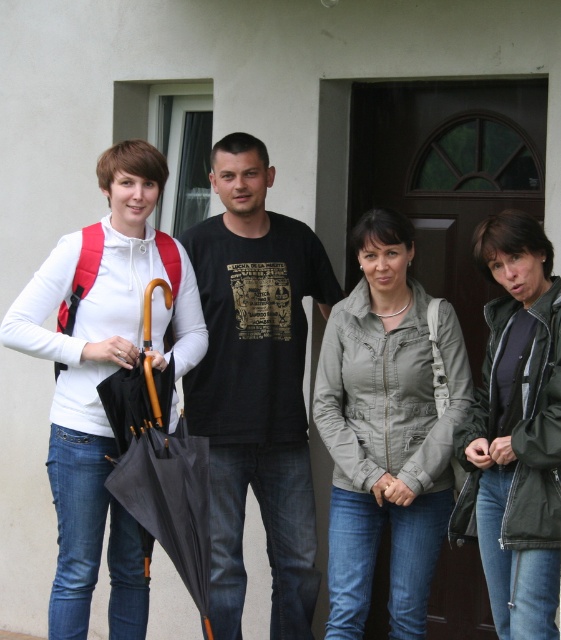
Question: Which object appears farthest from the camera in this image?

Choices:
 (A) black matte umbrella at left
 (B) matte khaki jacket at center
 (C) black cotton t-shirt at center
 (D) green matte jacket at lower right

Answer: (C)

Question: Considering the real-world distances, which object is closest to the green matte jacket at lower right?

Choices:
 (A) black cotton t-shirt at center
 (B) matte white hoodie at left
 (C) matte khaki jacket at center
 (D) black matte umbrella at left

Answer: (C)

Question: Does green matte jacket at lower right appear over black matte umbrella at left?

Choices:
 (A) no
 (B) yes

Answer: (B)

Question: Which object appears farthest from the camera in this image?

Choices:
 (A) black matte umbrella at left
 (B) matte white hoodie at left
 (C) matte khaki jacket at center
 (D) black cotton t-shirt at center

Answer: (D)

Question: Is green matte jacket at lower right positioned at the back of black matte umbrella at left?

Choices:
 (A) yes
 (B) no

Answer: (B)

Question: Does matte khaki jacket at center appear on the right side of green matte jacket at lower right?

Choices:
 (A) no
 (B) yes

Answer: (A)